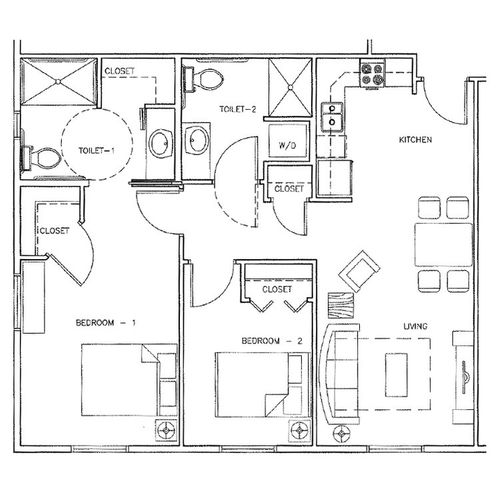
Find the location of `bathroom closets`. bathroom closets is located at coordinates (286, 192), (126, 66).